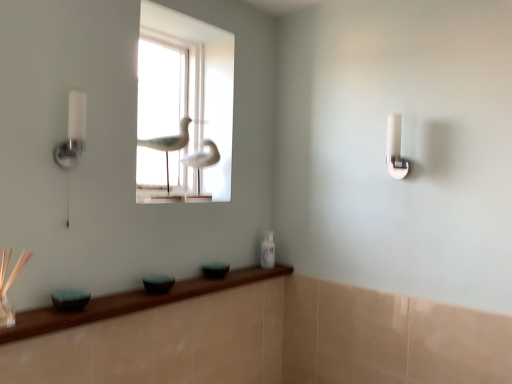
Question: Does transparent glass door at center come in front of teal glass bowl at lower left, acting as the first glass bowl starting from the left?

Choices:
 (A) no
 (B) yes

Answer: (A)

Question: Is transparent glass door at center facing away from teal glass bowl at lower left, the first glass bowl when ordered from front to back?

Choices:
 (A) no
 (B) yes

Answer: (A)

Question: From the image's perspective, is transparent glass door at center below teal glass bowl at lower left, acting as the 3th glass bowl starting from the right?

Choices:
 (A) no
 (B) yes

Answer: (A)

Question: Considering the relative sizes of transparent glass door at center and teal glass bowl at lower left, the first glass bowl when ordered from front to back, in the image provided, is transparent glass door at center smaller than teal glass bowl at lower left, the first glass bowl when ordered from front to back,?

Choices:
 (A) yes
 (B) no

Answer: (B)

Question: Can we say transparent glass door at center lies outside teal glass bowl at lower left, acting as the 3th glass bowl starting from the right?

Choices:
 (A) yes
 (B) no

Answer: (A)

Question: Does transparent glass door at center have a greater height compared to teal glass bowl at lower left, acting as the first glass bowl starting from the left?

Choices:
 (A) no
 (B) yes

Answer: (B)

Question: Is white glossy bottle at lower center to the left of white matte bird at center, which appears as the 2th bird when viewed from the front, from the viewer's perspective?

Choices:
 (A) no
 (B) yes

Answer: (A)

Question: Does white glossy bottle at lower center have a greater height compared to white matte bird at center, which appears as the 2th bird when viewed from the front?

Choices:
 (A) yes
 (B) no

Answer: (B)

Question: From the image's perspective, is white glossy bottle at lower center on top of white matte bird at center, which is the 1th bird in back-to-front order?

Choices:
 (A) yes
 (B) no

Answer: (B)

Question: Considering the relative sizes of white glossy bottle at lower center and white matte bird at center, which appears as the 2th bird when viewed from the front, in the image provided, is white glossy bottle at lower center thinner than white matte bird at center, which appears as the 2th bird when viewed from the front,?

Choices:
 (A) no
 (B) yes

Answer: (B)

Question: Considering the relative sizes of white glossy bottle at lower center and white matte bird at center, which appears as the 2th bird when viewed from the front, in the image provided, is white glossy bottle at lower center bigger than white matte bird at center, which appears as the 2th bird when viewed from the front,?

Choices:
 (A) no
 (B) yes

Answer: (A)

Question: Considering the relative sizes of white glossy bottle at lower center and white matte bird at center, which appears as the 2th bird when viewed from the front, in the image provided, is white glossy bottle at lower center smaller than white matte bird at center, which appears as the 2th bird when viewed from the front,?

Choices:
 (A) no
 (B) yes

Answer: (B)

Question: Does white glossy bottle at lower center have a larger size compared to transparent glass door at center?

Choices:
 (A) yes
 (B) no

Answer: (B)